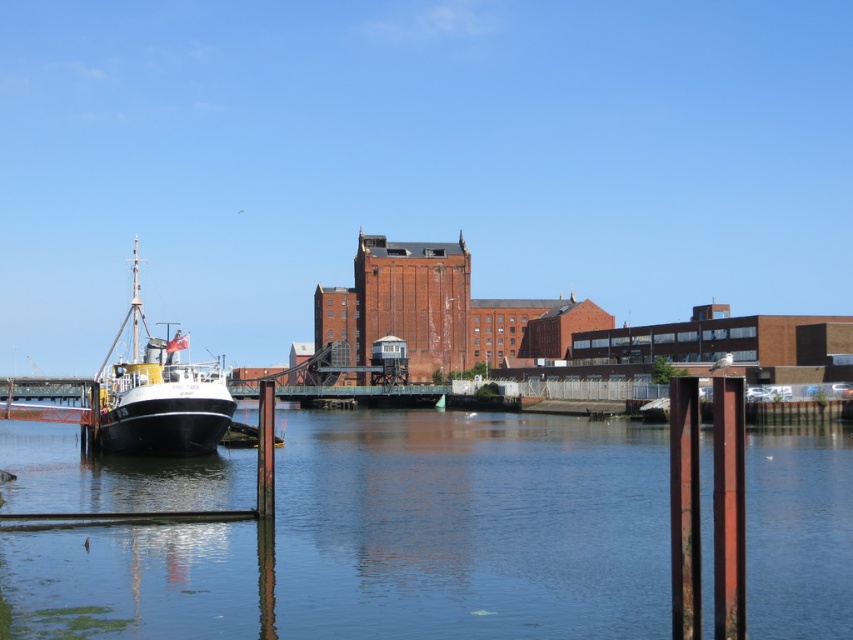
You are a photographer planning to capture the entire scene in one shot. Given that your camera can only focus on objects within a 10 meter width, will the clear blue water at center and the polished black ship at left fit within this width constraint?

The clear blue water at center is wider than the polished black ship at left. Since the camera can focus on objects within a 10 meter width, both objects can fit as long as their combined width does not exceed 10 meters. However, the exact dimensions are not provided, so it depends on their actual widths.

Consider the image. You are a photographer planning to capture the clear blue water at center and the polished black ship at left in a single shot. Based on their sizes, which object should you focus on first to ensure both are in frame?

The clear blue water at center has a smaller size compared to polished black ship at left, so you should focus on the polished black ship at left first to ensure both fit within the frame.

You are standing on the dock and want to locate the clear blue water at center. According to the coordinates provided, where should you look relative to your position?

The clear blue water at center is located at coordinates point (469,525), so you should look towards the lower right direction from your current position on the dock.